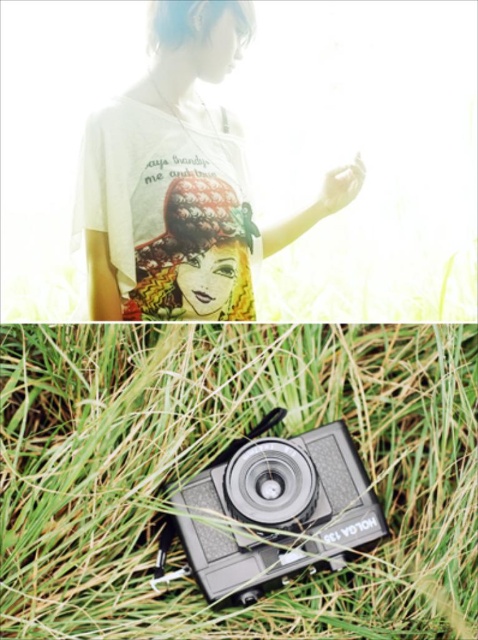
Which is more to the left, matte white t-shirt at upper center or matte silver lens at center?

matte white t-shirt at upper center

Between matte white t-shirt at upper center and matte silver lens at center, which one has more height?

Standing taller between the two is matte white t-shirt at upper center.

Who is more distant from viewer, [195,312] or [291,477]?

The point [195,312] is more distant.

This screenshot has width=478, height=640. Identify the location of matte white t-shirt at upper center. (181, 180).

How much distance is there between green grass at lower center and metallic silver film camera at lower center?

They are 3.73 inches apart.

Who is positioned more to the right, green grass at lower center or metallic silver film camera at lower center?

Positioned to the right is metallic silver film camera at lower center.

Which is behind, point (310, 589) or point (324, 461)?

Point (324, 461)

The image size is (478, 640). I want to click on green grass at lower center, so click(217, 452).

Consider the image. Who is more distant from viewer, (347, 528) or (310, 480)?

Point (310, 480)

Can you confirm if metallic silver film camera at lower center is positioned to the left of matte silver lens at center?

Correct, you'll find metallic silver film camera at lower center to the left of matte silver lens at center.

Does point (230, 538) come closer to viewer compared to point (308, 509)?

No.

At what (x,y) coordinates should I click in order to perform the action: click on metallic silver film camera at lower center. Please return your answer as a coordinate pair (x, y). Looking at the image, I should click on (273, 508).